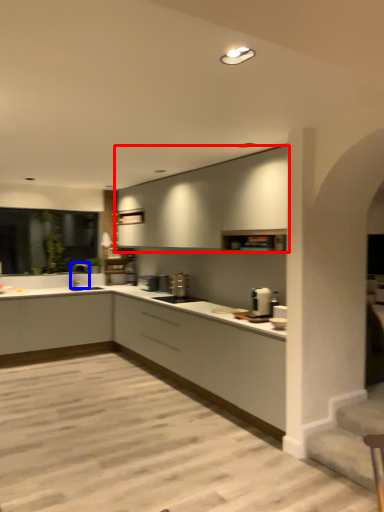
Question: Which object is further to the camera taking this photo, cabinetry (highlighted by a red box) or tap (highlighted by a blue box)?

Choices:
 (A) cabinetry
 (B) tap

Answer: (B)